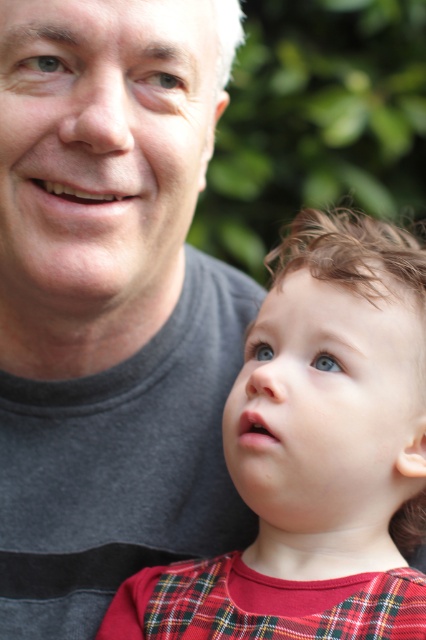
Does point (11, 419) lie in front of point (408, 536)?

No, (11, 419) is behind (408, 536).

Is point (62, 264) farther from camera compared to point (152, 602)?

No, (62, 264) is closer to viewer.

Between point (106, 22) and point (279, 436), which one is positioned behind?

Positioned behind is point (279, 436).

The image size is (426, 640). What are the coordinates of `gray matte t-shirt at upper left` in the screenshot? It's located at (111, 304).